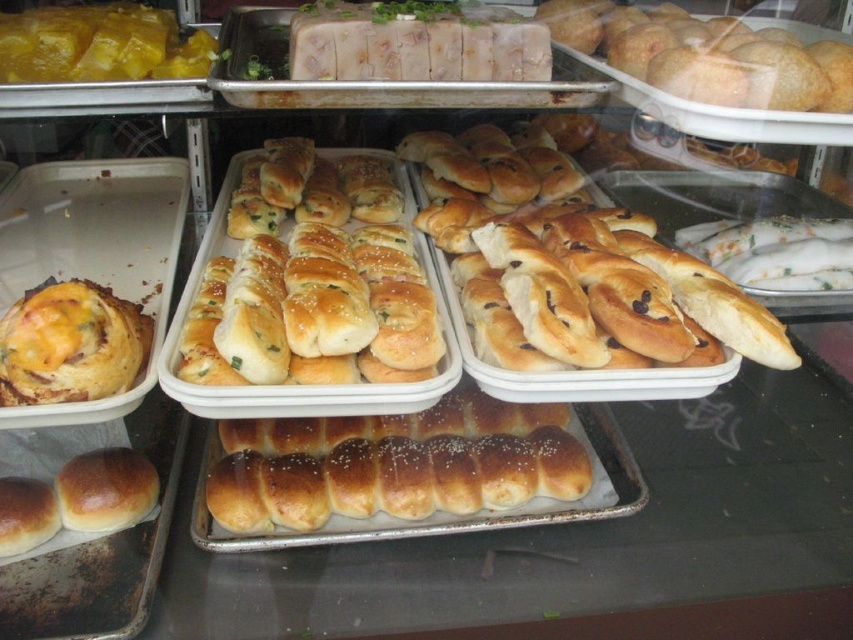
Is golden brown crusty bagel at center wider than yellow cheesy bread at left?

Yes, golden brown crusty bagel at center is wider than yellow cheesy bread at left.

Is golden brown crusty bagel at center further to camera compared to yellow cheesy bread at left?

Yes, golden brown crusty bagel at center is behind yellow cheesy bread at left.

Find the location of a particular element. golden brown crusty bagel at center is located at coordinates (706, 56).

Who is shorter, golden brown doughnut at center or yellow cheesy bread at left?

Standing shorter between the two is yellow cheesy bread at left.

Locate an element on the screen. This screenshot has height=640, width=853. golden brown doughnut at center is located at coordinates (576, 266).

Is golden brown crusty rolls at center bigger than golden brown crusty bagel at center?

Indeed, golden brown crusty rolls at center has a larger size compared to golden brown crusty bagel at center.

Does golden brown crusty rolls at center have a smaller size compared to golden brown crusty bagel at center?

Incorrect, golden brown crusty rolls at center is not smaller in size than golden brown crusty bagel at center.

Who is more forward, (392, 374) or (614, 45)?

Point (392, 374)

Locate an element on the screen. The width and height of the screenshot is (853, 640). golden brown crusty rolls at center is located at coordinates (312, 280).